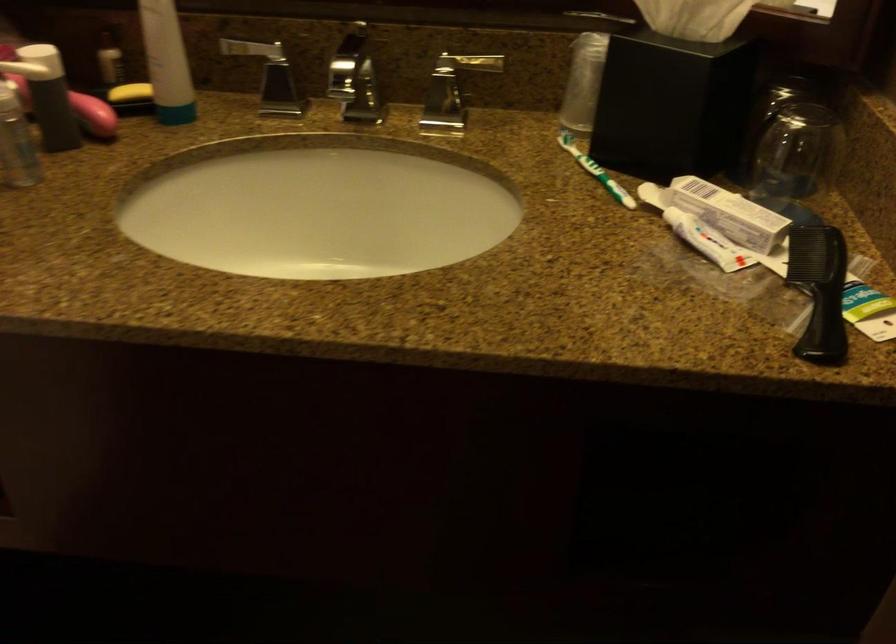
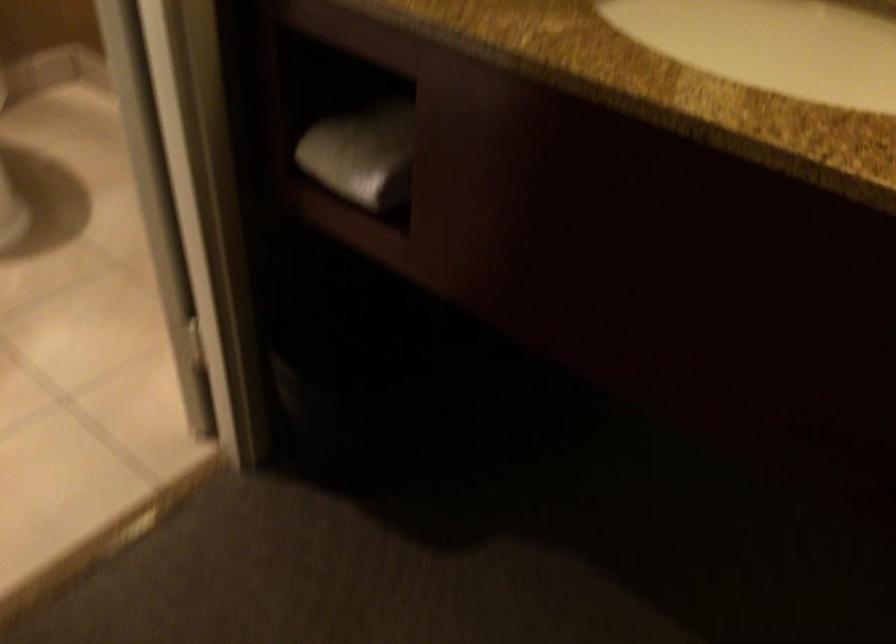
Question: Based on the continuous images, in which direction is the camera rotating? Reply with the corresponding letter.

Choices:
 (A) Left
 (B) Right
 (C) Up
 (D) Down

Answer: (A)